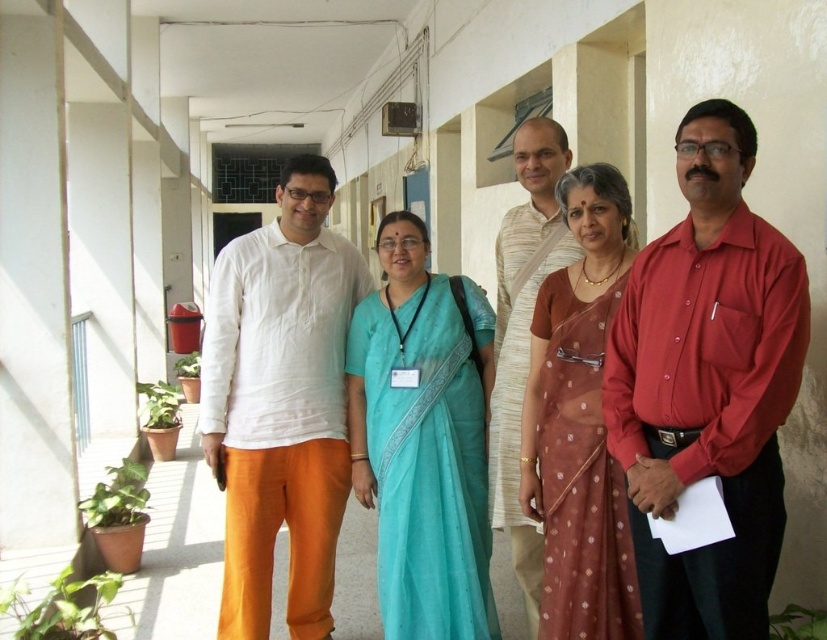
Which is below, shiny red shirt at right or light beige cotton shirt at center?

light beige cotton shirt at center is below.

Does shiny red shirt at right have a smaller size compared to light beige cotton shirt at center?

Correct, shiny red shirt at right occupies less space than light beige cotton shirt at center.

Identify the location of shiny red shirt at right. (708, 385).

Can you confirm if shiny red shirt at right is positioned above brown sheer saree at center?

Indeed, shiny red shirt at right is positioned over brown sheer saree at center.

Between point (729, 424) and point (560, 291), which one is positioned behind?

The point (560, 291) is more distant.

At what (x,y) coordinates should I click in order to perform the action: click on shiny red shirt at right. Please return your answer as a coordinate pair (x, y). Looking at the image, I should click on (708, 385).

Is brown sheer saree at center wider than light beige cotton shirt at center?

In fact, brown sheer saree at center might be narrower than light beige cotton shirt at center.

Which is in front, point (546, 602) or point (522, 529)?

Positioned in front is point (546, 602).

Identify the location of brown sheer saree at center. This screenshot has width=827, height=640. (579, 474).

Locate an element on the screen. This screenshot has width=827, height=640. brown sheer saree at center is located at coordinates (579, 474).